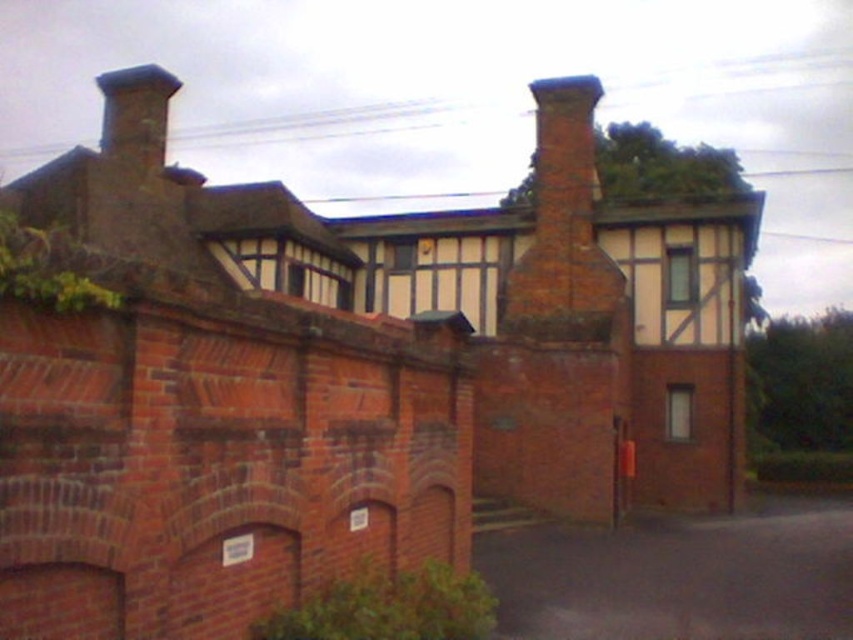
You are a gardener planning to trim the green leafy ivy at lower center and the smooth brick chimney at upper left. Which object requires more horizontal space for maintenance?

The smooth brick chimney at upper left requires more horizontal space for maintenance since its width is greater than the green leafy ivy at lower center.

You are standing in front of the traditional Tudor building and notice a specific location marked by coordinates. Where exactly is the green leafy ivy at lower center located on the building?

The green leafy ivy at lower center is located at point coordinates of (389, 605) on the building.